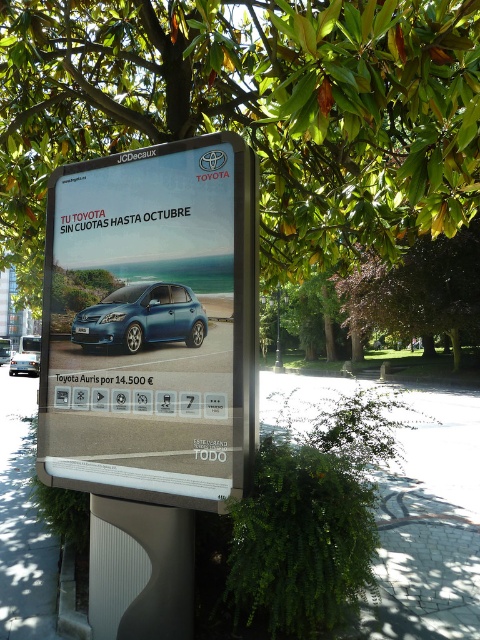
Does white concrete pavement at lower center have a larger size compared to paved stone at lower center?

Correct, white concrete pavement at lower center is larger in size than paved stone at lower center.

Does point (444, 426) come behind point (470, 538)?

That is True.

I want to click on white concrete pavement at lower center, so click(x=431, y=524).

Does green leafy tree at center have a greater height compared to metallic blue hatchback at center?

Correct, green leafy tree at center is much taller as metallic blue hatchback at center.

At what (x,y) coordinates should I click in order to perform the action: click on green leafy tree at center. Please return your answer as a coordinate pair (x, y). The width and height of the screenshot is (480, 640). Looking at the image, I should click on (420, 291).

Locate an element on the screen. green leafy tree at center is located at coordinates (420, 291).

Does white concrete pavement at lower center appear over metallic pole at center?

No, white concrete pavement at lower center is not above metallic pole at center.

Who is lower down, white concrete pavement at lower center or metallic pole at center?

white concrete pavement at lower center

Locate an element on the screen. The height and width of the screenshot is (640, 480). white concrete pavement at lower center is located at coordinates (431, 524).